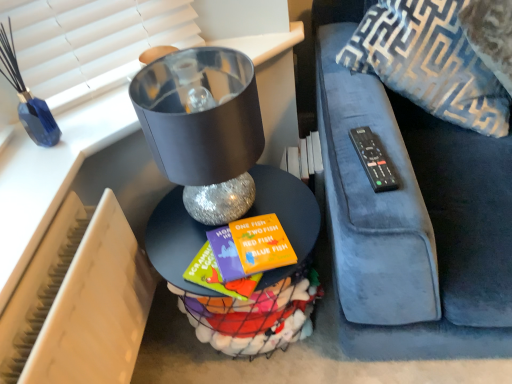
Question: From a real-world perspective, is metallic silver table at center below black plastic remote at right?

Choices:
 (A) no
 (B) yes

Answer: (B)

Question: Is metallic silver table at center at the left side of black plastic remote at right?

Choices:
 (A) no
 (B) yes

Answer: (B)

Question: Can you confirm if metallic silver table at center is taller than black plastic remote at right?

Choices:
 (A) no
 (B) yes

Answer: (B)

Question: Is metallic silver table at center touching black plastic remote at right?

Choices:
 (A) no
 (B) yes

Answer: (A)

Question: Are metallic silver table at center and black plastic remote at right located far from each other?

Choices:
 (A) no
 (B) yes

Answer: (A)

Question: From a real-world perspective, relative to shiny metallic lampshade at center, is beige plastic radiator at lower left vertically above or below?

Choices:
 (A) above
 (B) below

Answer: (B)

Question: From the image's perspective, is beige plastic radiator at lower left above or below shiny metallic lampshade at center?

Choices:
 (A) below
 (B) above

Answer: (A)

Question: Looking at their shapes, would you say beige plastic radiator at lower left is wider or thinner than shiny metallic lampshade at center?

Choices:
 (A) wide
 (B) thin

Answer: (B)

Question: In the image, is beige plastic radiator at lower left positioned in front of or behind shiny metallic lampshade at center?

Choices:
 (A) behind
 (B) front

Answer: (B)

Question: Does point (425, 36) appear closer or farther from the camera than point (182, 306)?

Choices:
 (A) farther
 (B) closer

Answer: (B)

Question: From a real-world perspective, is blue textured throw pillow at upper right positioned above or below metallic silver table at center?

Choices:
 (A) above
 (B) below

Answer: (A)

Question: In the image, is blue textured throw pillow at upper right on the left side or the right side of metallic silver table at center?

Choices:
 (A) right
 (B) left

Answer: (A)

Question: Is blue textured throw pillow at upper right wider or thinner than metallic silver table at center?

Choices:
 (A) wide
 (B) thin

Answer: (B)

Question: Which is correct: metallic silver table at center is inside black plastic remote at right, or outside of it?

Choices:
 (A) inside
 (B) outside

Answer: (B)

Question: In the image, is metallic silver table at center on the left side or the right side of black plastic remote at right?

Choices:
 (A) left
 (B) right

Answer: (A)